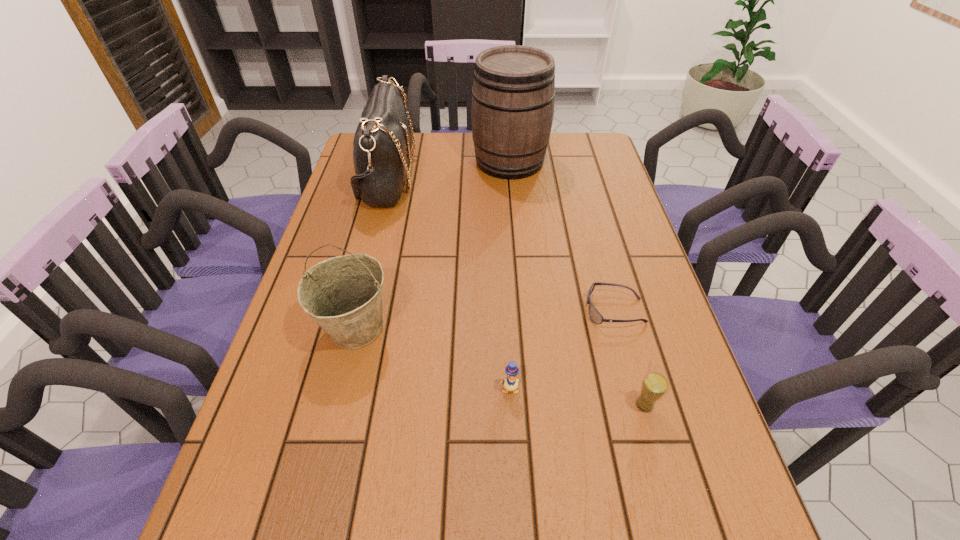
The height and width of the screenshot is (540, 960). Find the location of `free space that satisfies the following two spatial constraints: 1. at the front of the left wine bucket with chain and zipper; 2. on the left side of the handbag`. free space that satisfies the following two spatial constraints: 1. at the front of the left wine bucket with chain and zipper; 2. on the left side of the handbag is located at coordinates (348, 327).

Identify the location of free spot that satisfies the following two spatial constraints: 1. on the face of the second shortest object, where the monocle is placed; 2. on the right side of the straw for drinking. The width and height of the screenshot is (960, 540). (511, 405).

At what (x,y) coordinates should I click in order to perform the action: click on vacant space that satisfies the following two spatial constraints: 1. on the lenses of the shortest object; 2. on the face of the duckling, where the monocle is placed. Please return your answer as a coordinate pair (x, y). Looking at the image, I should click on (636, 389).